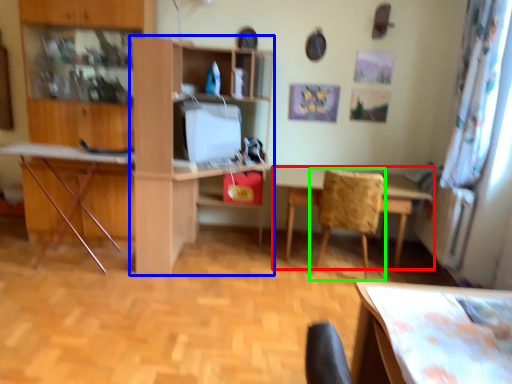
Question: Based on their relative distances, which object is nearer to table (highlighted by a red box)? Choose from shelf (highlighted by a blue box) and chair (highlighted by a green box).

Choices:
 (A) shelf
 (B) chair

Answer: (B)